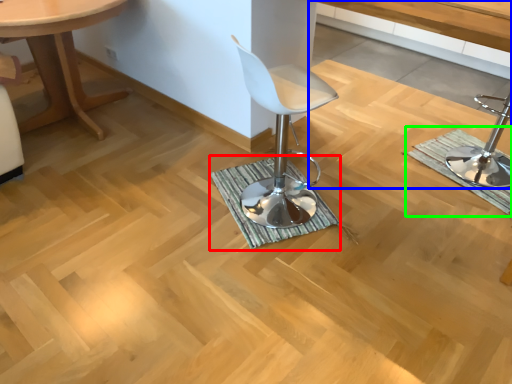
Question: Which object is positioned farthest from bath mat (highlighted by a red box)? Select from vanity (highlighted by a blue box) and bath mat (highlighted by a green box).

Choices:
 (A) vanity
 (B) bath mat

Answer: (A)